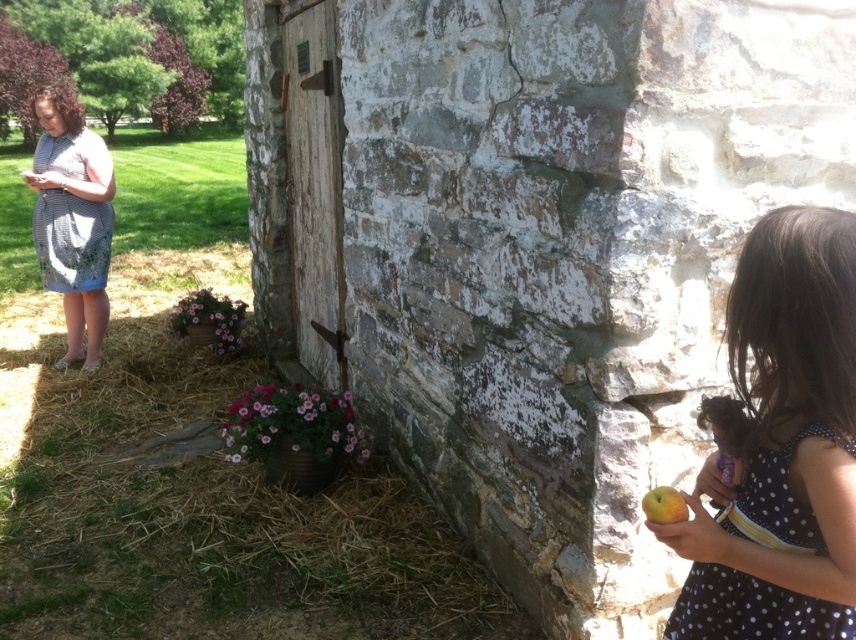
You are standing in the outdoor scene described. There is a brown straw at lower left. Can you estimate its location in terms of coordinates?

The brown straw at lower left is located at coordinates point (212, 522).

You are organizing a picnic and have brought a brown straw at lower left and a striped fabric dress at left. You want to place both items on the ground in front of the stone wall. Which item will occupy more horizontal space when placed side by side?

The brown straw at lower left will occupy more horizontal space because its width is larger than the striped fabric dress at left.